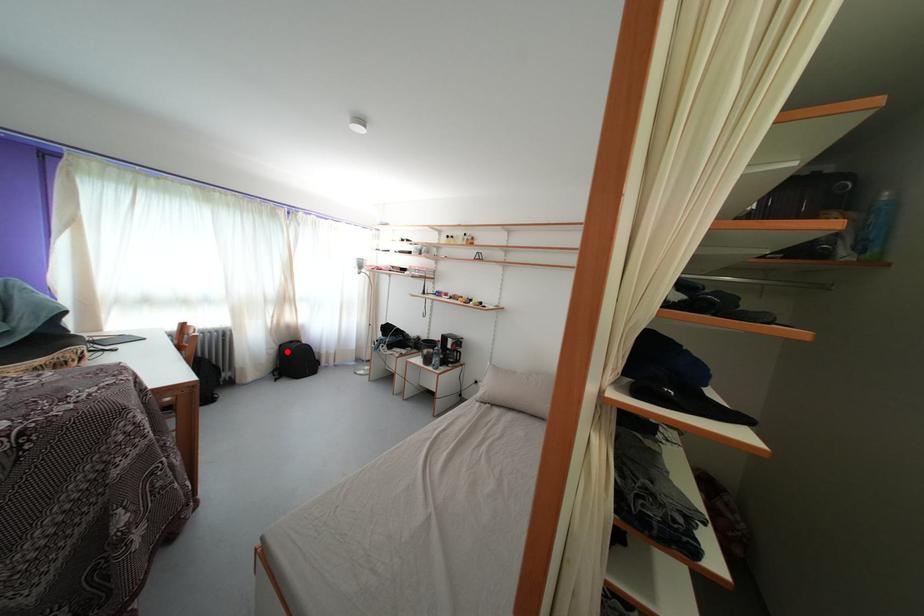
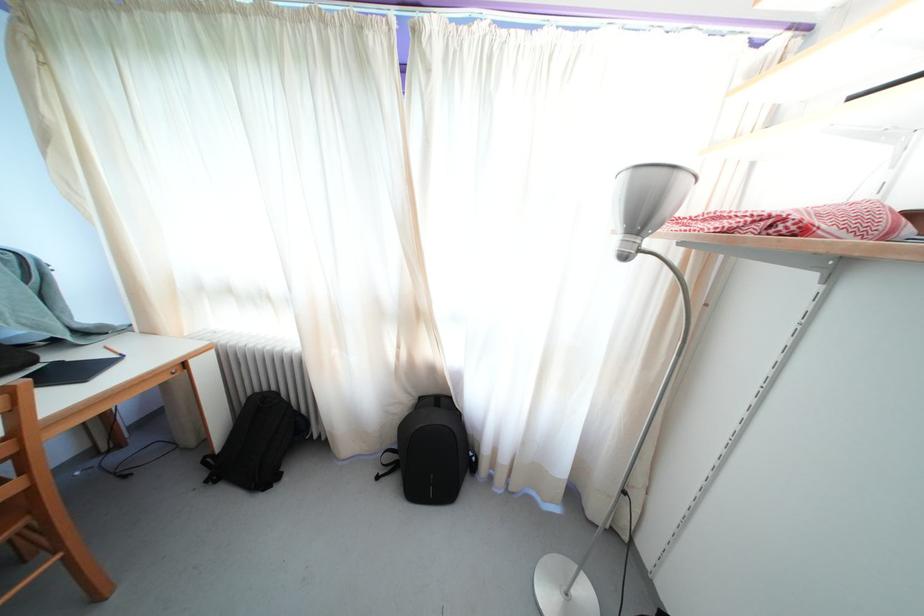
Question: I am providing you with two images of the same scene from different viewpoints. Image1 has a red point marked. In image2, the corresponding 3D location appears at what relative position? Reply with the corresponding letter.

Choices:
 (A) Closer
 (B) Farther

Answer: (B)